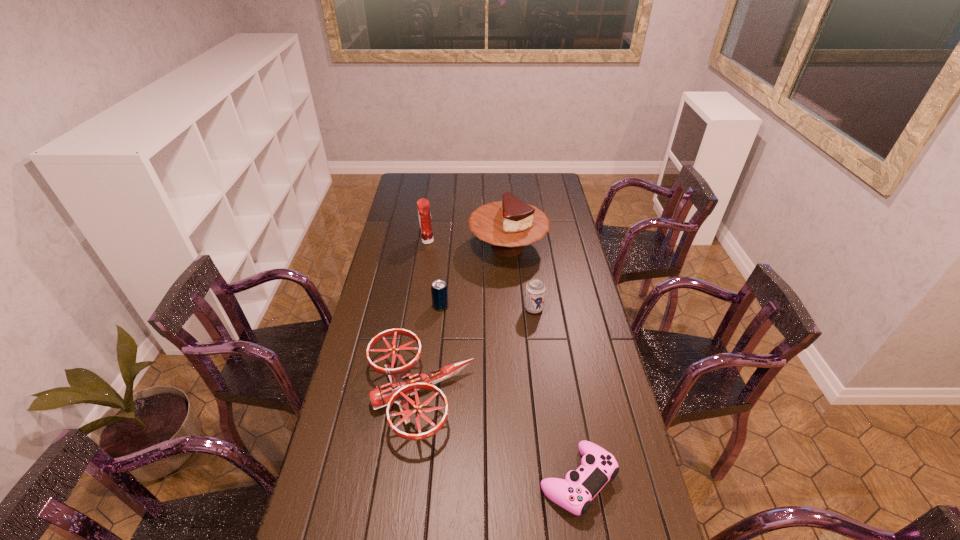
Locate an element on the screen. The image size is (960, 540). empty location between the drone and the shortest object is located at coordinates [498, 437].

Where is `vacant area between the soda can and the control`? The image size is (960, 540). vacant area between the soda can and the control is located at coordinates (509, 393).

Find the location of a particular element. vacant area that lies between the shortest object and the soda can is located at coordinates (509, 393).

Find the location of `free space that is in between the beer can and the drone`. free space that is in between the beer can and the drone is located at coordinates (476, 352).

Where is `free space between the beer can and the condiment`? free space between the beer can and the condiment is located at coordinates (480, 275).

Identify which object is the fifth nearest to the control. Please provide its 2D coordinates. Your answer should be formatted as a tuple, i.e. [(x, y)], where the tuple contains the x and y coordinates of a point satisfying the conditions above.

[(423, 205)]

Point out which object is positioned as the nearest to the beer can. Please provide its 2D coordinates. Your answer should be formatted as a tuple, i.e. [(x, y)], where the tuple contains the x and y coordinates of a point satisfying the conditions above.

[(509, 225)]